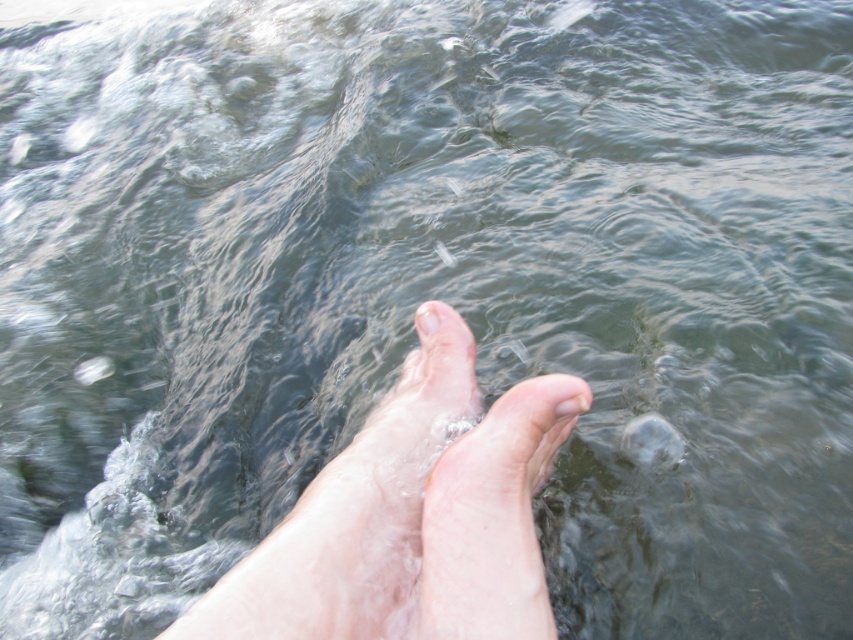
Looking at this image, you are a lifeguard observing a swimmer in a pool. You notice the pale skin feet at center and the pale skin toe at center. Which object is closer to you?

The pale skin feet at center is closer to you because it is in front of the pale skin toe at center.